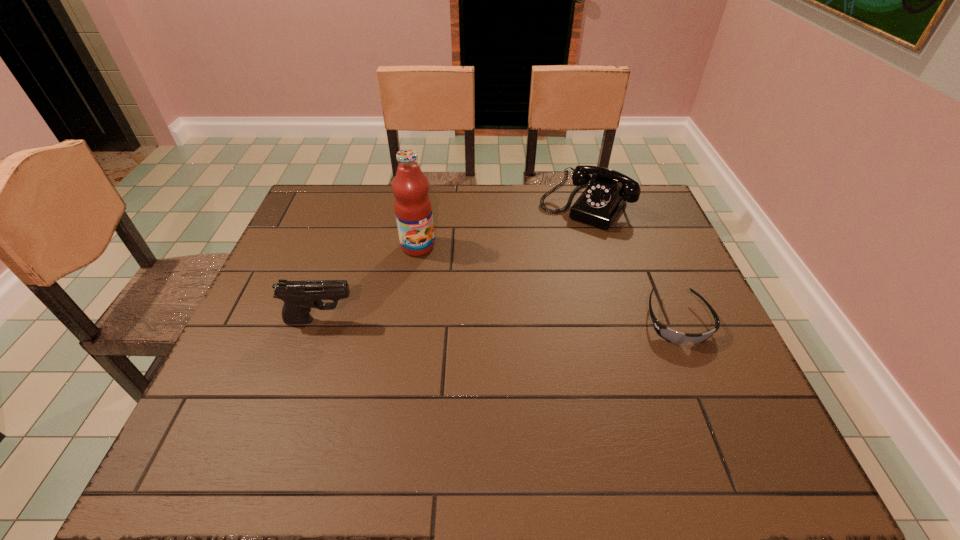
This screenshot has height=540, width=960. Find the location of `blank space at the far left corner of the desktop`. blank space at the far left corner of the desktop is located at coordinates (299, 224).

You are a GUI agent. You are given a task and a screenshot of the screen. Output one action in this format:
    pyautogui.click(x=<x>, y=<y>)
    Task: Click on the free location at the far right corner
    
    Given the screenshot: What is the action you would take?
    pyautogui.click(x=655, y=205)

Where is `vacant space that's between the telephone and the shortest object`? This screenshot has height=540, width=960. vacant space that's between the telephone and the shortest object is located at coordinates (631, 264).

The image size is (960, 540). I want to click on vacant space that's between the telephone and the shortest object, so click(631, 264).

This screenshot has width=960, height=540. Find the location of `free spot between the sunglasses and the farthest object`. free spot between the sunglasses and the farthest object is located at coordinates (631, 264).

Identify the location of vacant area that lies between the leftmost object and the sunglasses. (499, 321).

This screenshot has width=960, height=540. I want to click on vacant space in between the telephone and the leftmost object, so click(x=453, y=264).

Image resolution: width=960 pixels, height=540 pixels. Find the location of `free space between the farthest object and the pistol`. free space between the farthest object and the pistol is located at coordinates (453, 264).

You are a GUI agent. You are given a task and a screenshot of the screen. Output one action in this format:
    pyautogui.click(x=<x>, y=<y>)
    Task: Click on the vacant area that lies between the tallest object and the telephone
    The image size is (960, 540).
    Given the screenshot: What is the action you would take?
    pyautogui.click(x=501, y=226)

You are a GUI agent. You are given a task and a screenshot of the screen. Output one action in this format:
    pyautogui.click(x=<x>, y=<y>)
    Task: Click on the free space between the telephone and the pistol
    
    Given the screenshot: What is the action you would take?
    pyautogui.click(x=453, y=264)